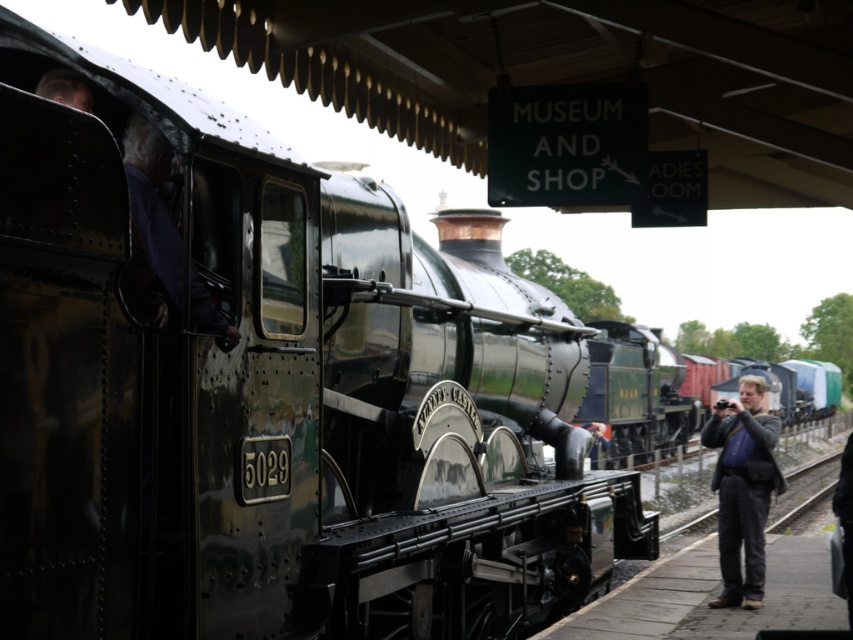
Does dark gray jacket at right have a greater height compared to purple fabric at center?

Yes.

Who is higher up, dark gray jacket at right or purple fabric at center?

purple fabric at center is higher up.

Identify the location of dark gray jacket at right. This screenshot has width=853, height=640. (741, 488).